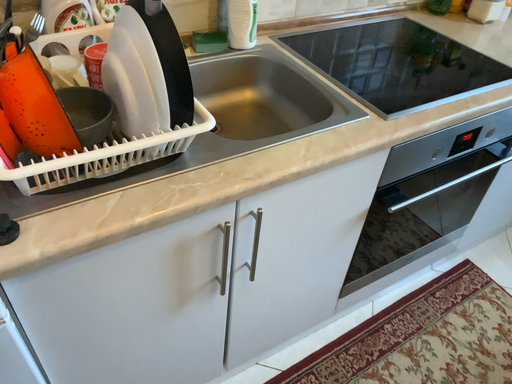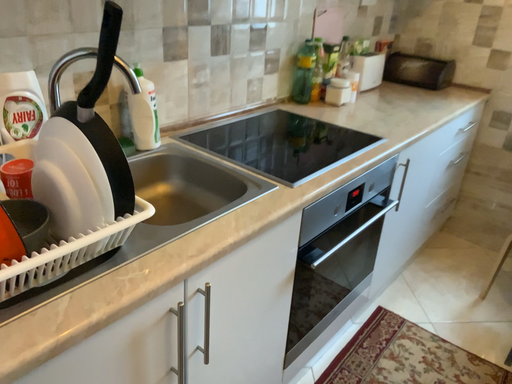
Question: How did the camera likely rotate when shooting the video?

Choices:
 (A) rotated upward
 (B) rotated downward

Answer: (A)